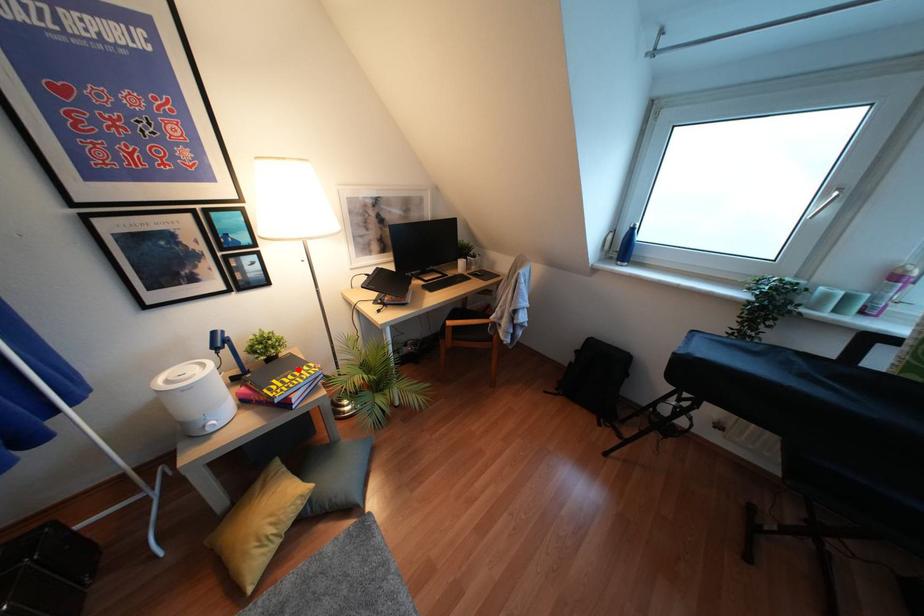
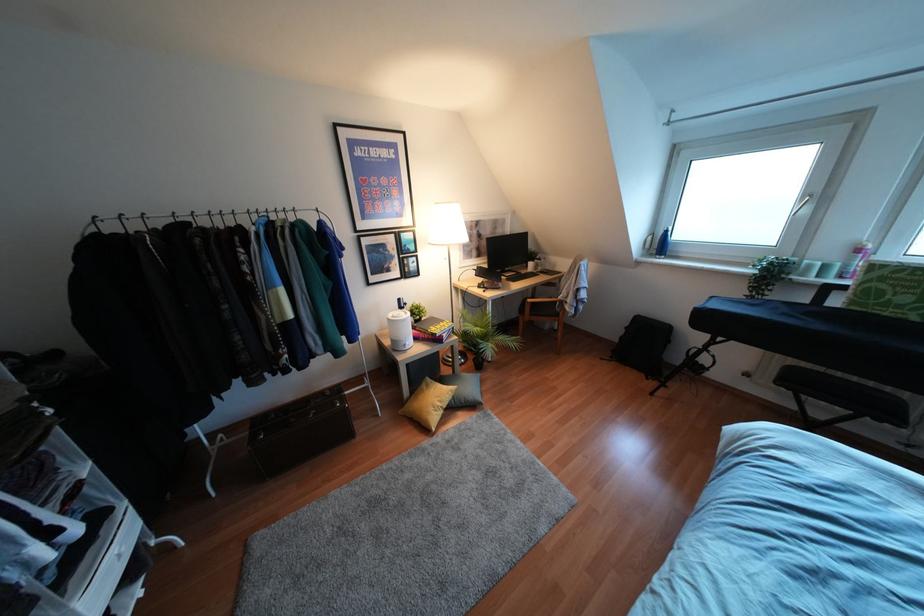
Find the pixel in the second image that matches the highlighted location in the first image.

(441, 323)